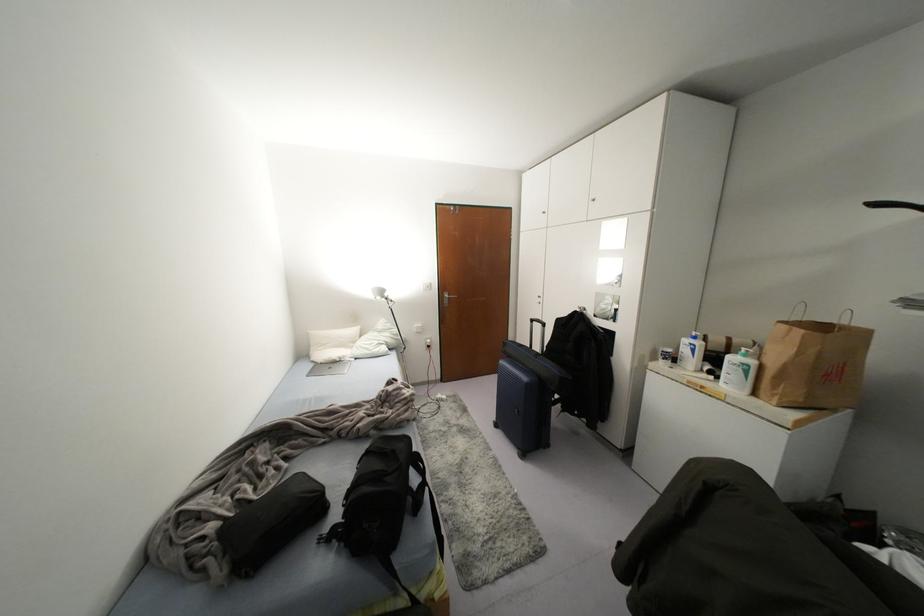
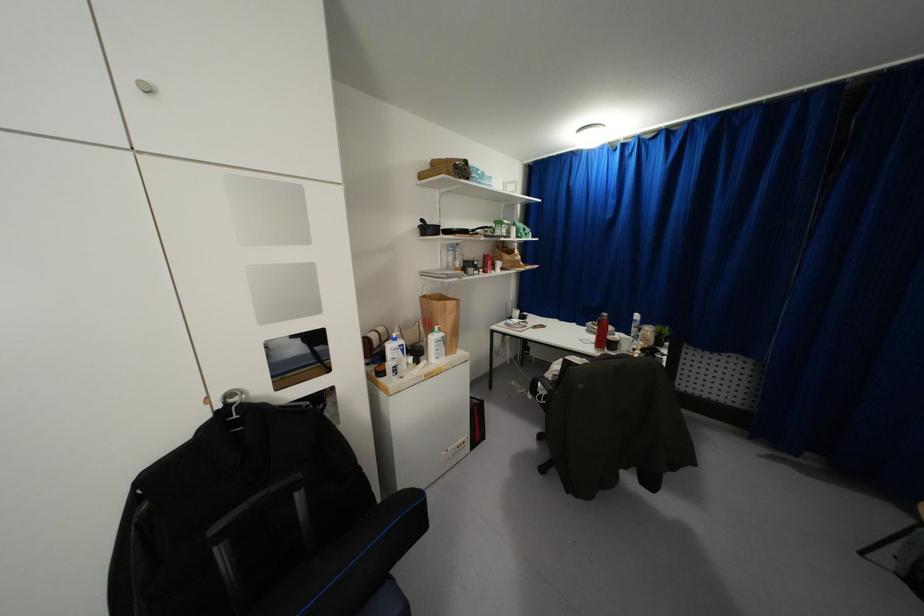
Where in the second image is the point corresponding to (x=751, y=362) from the first image?

(442, 333)